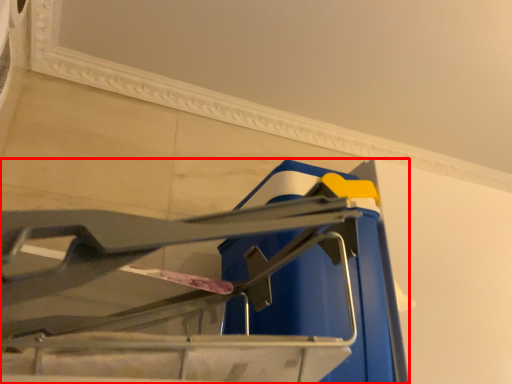
Question: Observing the image, what is the correct spatial positioning of furniture (annotated by the red box) in reference to window frame?

Choices:
 (A) left
 (B) right

Answer: (A)